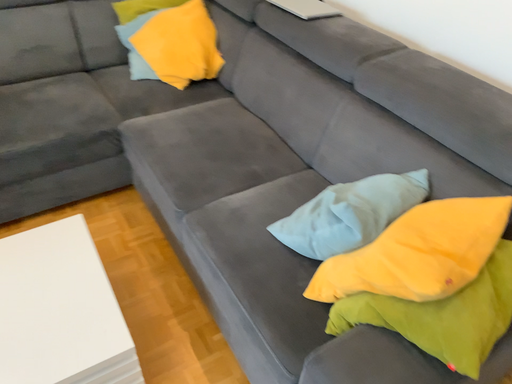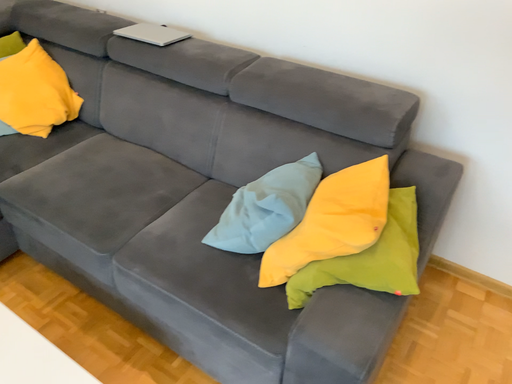
Question: How did the camera likely rotate when shooting the video?

Choices:
 (A) rotated left
 (B) rotated right

Answer: (B)